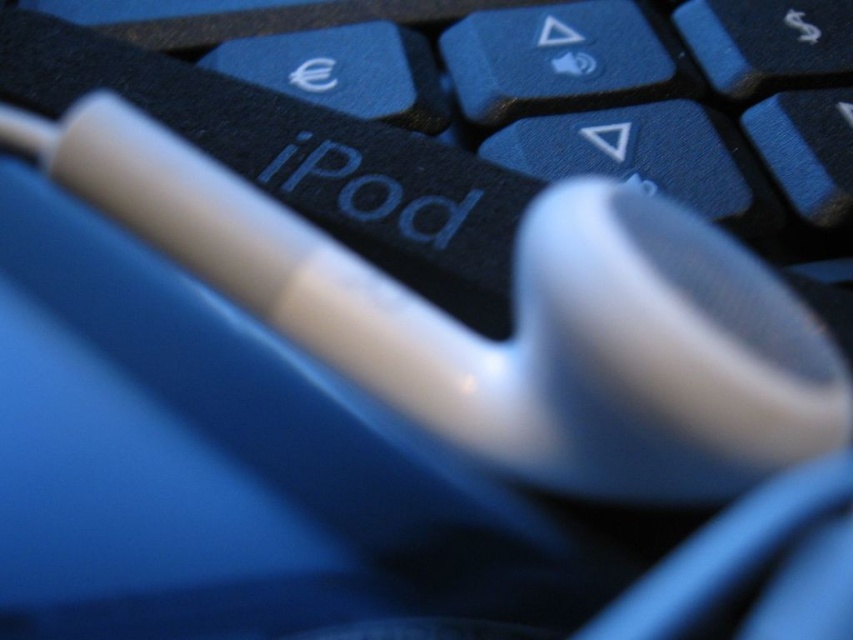
Does white plastic mouse at center have a smaller size compared to black matte keyboard at center?

Yes.

Which is in front, point (572, 308) or point (88, 44)?

Point (572, 308) is more forward.

Find the location of a particular element. white plastic mouse at center is located at coordinates pyautogui.click(x=514, y=320).